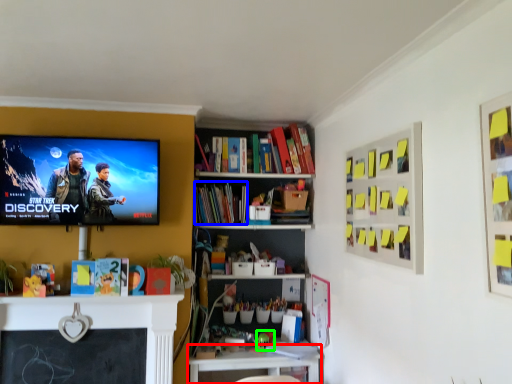
Question: Which object is positioned farthest from table (highlighted by a red box)? Select from book (highlighted by a blue box) and toy (highlighted by a green box).

Choices:
 (A) book
 (B) toy

Answer: (A)